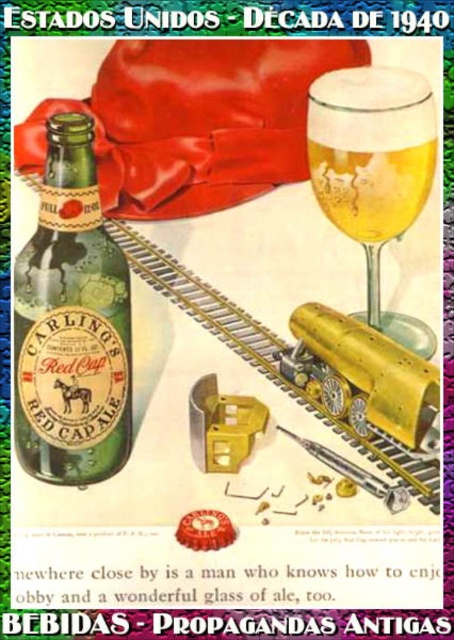
Question: Is green glass bottle at left bigger than translucent glass champagne at upper right?

Choices:
 (A) yes
 (B) no

Answer: (A)

Question: Which object is farther from the camera taking this photo?

Choices:
 (A) translucent glass champagne at upper right
 (B) green glass bottle at left

Answer: (A)

Question: Can you confirm if green glass bottle at left is positioned to the right of translucent glass champagne at upper right?

Choices:
 (A) no
 (B) yes

Answer: (A)

Question: Considering the real-world distances, which object is farthest from the green glass bottle at left?

Choices:
 (A) translucent glass beer at upper right
 (B) translucent glass champagne at upper right

Answer: (B)

Question: Observing the image, what is the correct spatial positioning of green glass bottle at left in reference to translucent glass beer at upper right?

Choices:
 (A) above
 (B) below

Answer: (B)

Question: Which point is closer to the camera?

Choices:
 (A) translucent glass champagne at upper right
 (B) green glass bottle at left

Answer: (B)